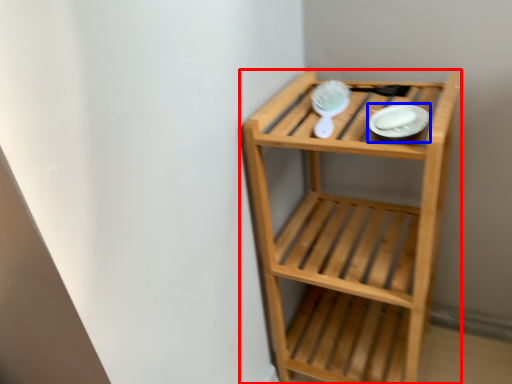
Question: Which of the following is the closest to the observer, shelf (highlighted by a red box) or platter (highlighted by a blue box)?

Choices:
 (A) shelf
 (B) platter

Answer: (A)